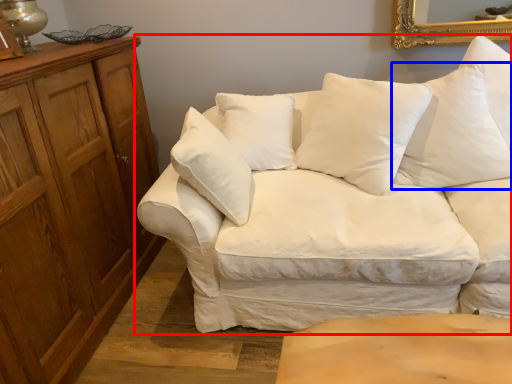
Question: Which of the following is the farthest to the observer, studio couch (highlighted by a red box) or pillow (highlighted by a blue box)?

Choices:
 (A) studio couch
 (B) pillow

Answer: (B)